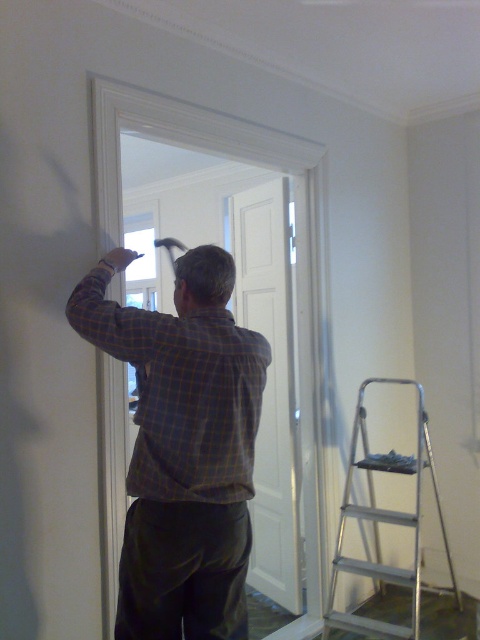
Based on the photo, is plaid shirt at center wider than silver metallic step ladder at lower right?

No.

Is plaid shirt at center to the left of silver metallic step ladder at lower right from the viewer's perspective?

Yes, plaid shirt at center is to the left of silver metallic step ladder at lower right.

Does point (191, 442) come closer to viewer compared to point (408, 572)?

Yes.

Identify the location of plaid shirt at center. (182, 445).